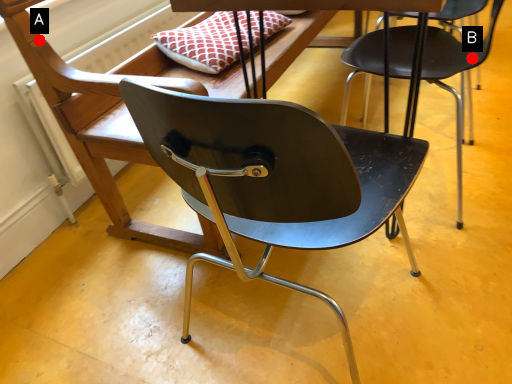
Question: Two points are circled on the image, labeled by A and B beside each circle. Which of the following is the farthest from the observer?

Choices:
 (A) A is further
 (B) B is further

Answer: (B)